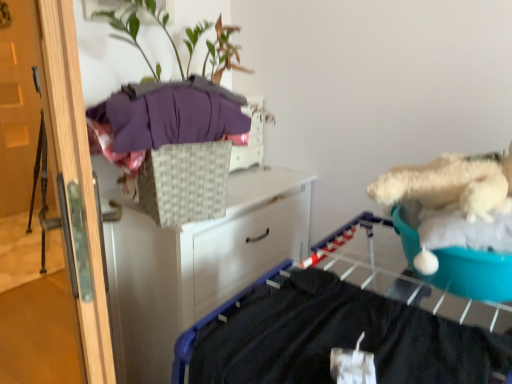
What is the approximate height of green leafy plant at upper center?

It is 10.99 inches.

Describe the element at coordinates (185, 182) in the screenshot. I see `white woven basket at upper center` at that location.

The image size is (512, 384). Describe the element at coordinates (473, 274) in the screenshot. I see `teal fabric at right` at that location.

Identify the location of green leafy plant at upper center. (157, 23).

In terms of height, does purple soft fabric at upper left look taller or shorter compared to green leafy plant at upper center?

Considering their sizes, purple soft fabric at upper left has less height than green leafy plant at upper center.

Find the location of `clothing located behind the green leafy plant at upper center`. clothing located behind the green leafy plant at upper center is located at coordinates (173, 114).

Consider the image. Would you say purple soft fabric at upper left is to the left or to the right of green leafy plant at upper center in the picture?

purple soft fabric at upper left is to the left of green leafy plant at upper center.

From the image's perspective, which one is positioned higher, purple soft fabric at upper left or green leafy plant at upper center?

green leafy plant at upper center.

Is wooden door at left at the back of teal fabric at right?

No, wooden door at left is not at the back of teal fabric at right.

Measure the distance from teal fabric at right to wooden door at left.

They are 5.95 feet apart.

From a real-world perspective, does teal fabric at right stand above wooden door at left?

Yes.

Which of these two, teal fabric at right or wooden door at left, is bigger?

wooden door at left.

Considering the relative sizes of white woven basket at upper center and green leafy plant at upper center in the image provided, is white woven basket at upper center thinner than green leafy plant at upper center?

Yes.

Can you confirm if white woven basket at upper center is taller than green leafy plant at upper center?

No.

From a real-world perspective, is white woven basket at upper center positioned under green leafy plant at upper center based on gravity?

Yes, from a real-world perspective, white woven basket at upper center is under green leafy plant at upper center.

Measure the distance between teal fabric at right and purple soft fabric at upper left.

They are 25.53 inches apart.

Looking at this image, which object is further away from the camera taking this photo, teal fabric at right or purple soft fabric at upper left?

purple soft fabric at upper left is behind.

Are teal fabric at right and purple soft fabric at upper left located far from each other?

No, teal fabric at right is not far away from purple soft fabric at upper left.

Is teal fabric at right facing towards purple soft fabric at upper left?

No.

Based on their sizes in the image, would you say green leafy plant at upper center is bigger or smaller than white woven basket at upper center?

green leafy plant at upper center is bigger than white woven basket at upper center.

In the scene shown: Is green leafy plant at upper center thinner than white woven basket at upper center?

Incorrect, the width of green leafy plant at upper center is not less than that of white woven basket at upper center.

Based on the photo, are green leafy plant at upper center and white woven basket at upper center beside each other?

There is a gap between green leafy plant at upper center and white woven basket at upper center.

From a real-world perspective, is green leafy plant at upper center under purple soft fabric at upper left?

No.

Is the surface of green leafy plant at upper center in direct contact with purple soft fabric at upper left?

No, green leafy plant at upper center is not making contact with purple soft fabric at upper left.

In the scene shown: Does green leafy plant at upper center appear on the left side of purple soft fabric at upper left?

No, green leafy plant at upper center is not to the left of purple soft fabric at upper left.

Can we say green leafy plant at upper center lies outside purple soft fabric at upper left?

Yes, green leafy plant at upper center is outside of purple soft fabric at upper left.

Between white woven basket at upper center and teal fabric at right, which one has smaller width?

white woven basket at upper center.

From a real-world perspective, is white woven basket at upper center physically located above or below teal fabric at right?

From a real-world perspective, white woven basket at upper center is physically above teal fabric at right.

Is white woven basket at upper center spatially inside teal fabric at right, or outside of it?

white woven basket at upper center is not enclosed by teal fabric at right.

From the image's perspective, between white woven basket at upper center and teal fabric at right, which one is located above?

white woven basket at upper center appears higher in the image.

You are a GUI agent. You are given a task and a screenshot of the screen. Output one action in this format:
    pyautogui.click(x=<x>, y=<y>)
    Task: Click on the clothing directly beneath the green leafy plant at upper center (from a real-world perspective)
    The image size is (512, 384).
    Given the screenshot: What is the action you would take?
    pyautogui.click(x=173, y=114)

This screenshot has height=384, width=512. There is a wooden door at left. Find the location of `teal above it (from a real-world perspective)`. teal above it (from a real-world perspective) is located at coordinates (473, 274).

When comparing their distances from teal fabric at right, does wooden door at left or purple soft fabric at upper left seem further?

wooden door at left is positioned further to the anchor teal fabric at right.

From the image, which object appears to be farther from wooden door at left, purple soft fabric at upper left or white woven basket at upper center?

purple soft fabric at upper left is further to wooden door at left.

Looking at the image, which one is located closer to wooden door at left, green leafy plant at upper center or teal fabric at right?

green leafy plant at upper center is closer to wooden door at left.

Considering their positions, is purple soft fabric at upper left positioned further to wooden door at left than green leafy plant at upper center?

green leafy plant at upper center lies further to wooden door at left than the other object.

Based on their spatial positions, is purple soft fabric at upper left or white woven basket at upper center further from white woven basket at upper center?

white woven basket at upper center is positioned further to the anchor white woven basket at upper center.

When comparing their distances from teal fabric at right, does white woven basket at upper center or wooden door at left seem further?

Among the two, wooden door at left is located further to teal fabric at right.

Looking at the image, which one is located closer to white woven basket at upper center, purple soft fabric at upper left or teal fabric at right?

purple soft fabric at upper left is positioned closer to the anchor white woven basket at upper center.

From the image, which object appears to be nearer to green leafy plant at upper center, teal fabric at right or white woven basket at upper center?

Among the two, white woven basket at upper center is located nearer to green leafy plant at upper center.

This screenshot has height=384, width=512. In order to click on plant between white woven basket at upper center and teal fabric at right in the horizontal direction in this screenshot , I will do `click(157, 23)`.

Locate an element on the screen. plant between wooden door at left and teal fabric at right is located at coordinates (157, 23).

You are a GUI agent. You are given a task and a screenshot of the screen. Output one action in this format:
    pyautogui.click(x=<x>, y=<y>)
    Task: Click on the clothing that lies between green leafy plant at upper center and white woven basket at upper center from top to bottom
    
    Given the screenshot: What is the action you would take?
    pyautogui.click(x=173, y=114)

The image size is (512, 384). What are the coordinates of `clothing between wooden door at left and teal fabric at right from left to right` in the screenshot? It's located at (173, 114).